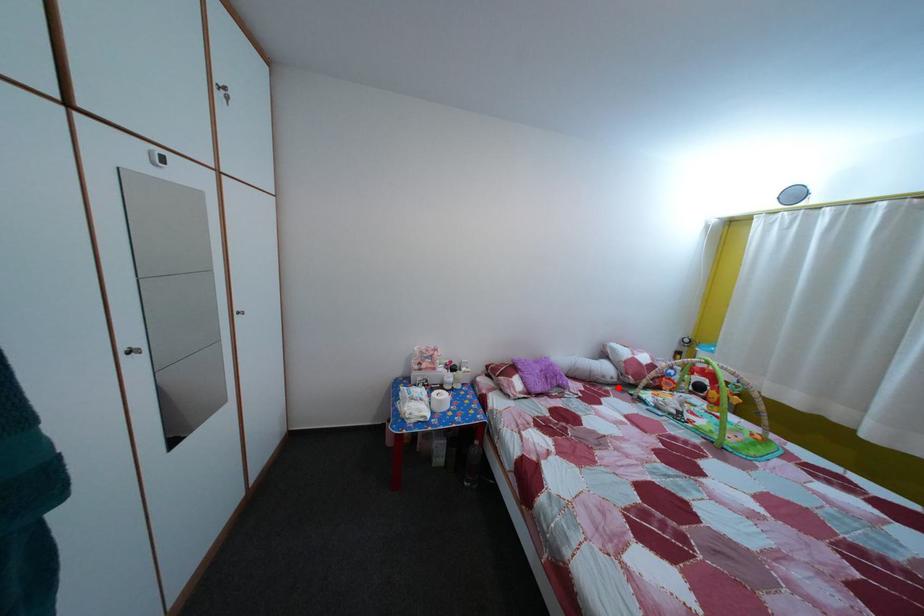
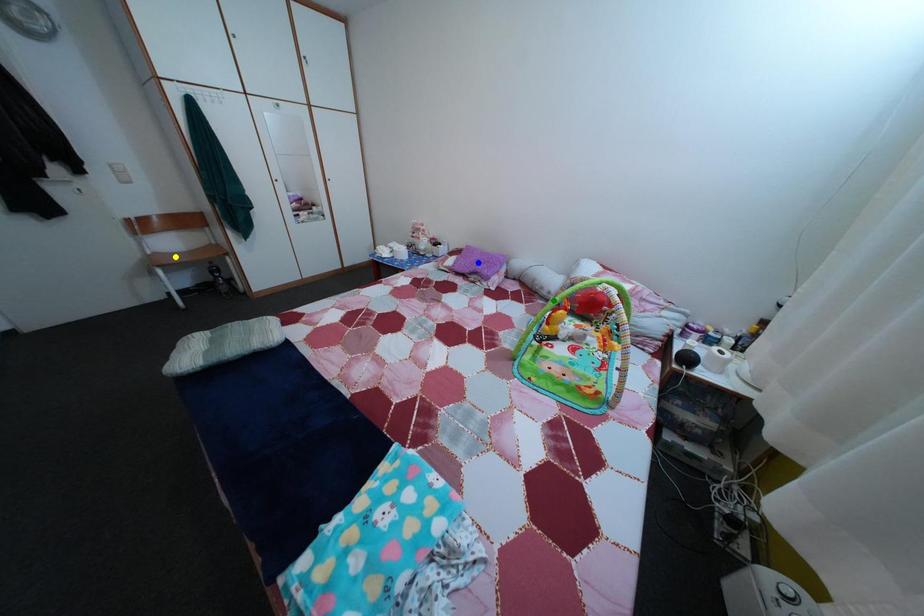
Question: I am providing you with two images of the same scene from different viewpoints. A red point is marked on the first image. You are given multiple points on the second image. Which point in image 2 represents the same 3d spot as the red point in image 1?

Choices:
 (A) blue point
 (B) green point
 (C) yellow point

Answer: (B)